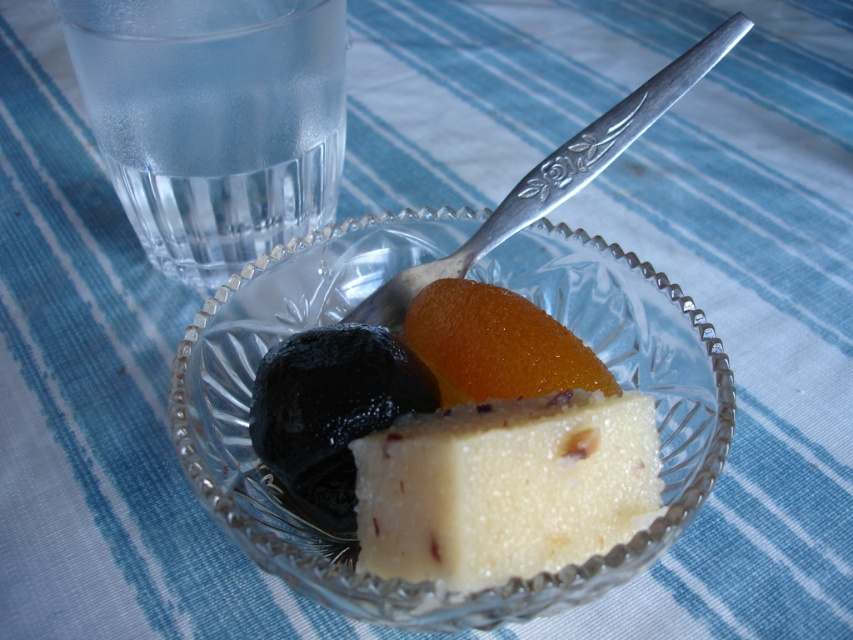
Can you confirm if clear crystal bowl at center is bigger than transparent glass water at upper left?

Yes, clear crystal bowl at center is bigger than transparent glass water at upper left.

Is clear crystal bowl at center to the left of transparent glass water at upper left from the viewer's perspective?

Result: No, clear crystal bowl at center is not to the left of transparent glass water at upper left.

The height and width of the screenshot is (640, 853). What do you see at coordinates (473, 278) in the screenshot? I see `clear crystal bowl at center` at bounding box center [473, 278].

You are a GUI agent. You are given a task and a screenshot of the screen. Output one action in this format:
    pyautogui.click(x=<x>, y=<y>)
    Task: Click on the clear crystal bowl at center
    This screenshot has height=640, width=853.
    Given the screenshot: What is the action you would take?
    pyautogui.click(x=473, y=278)

Is clear crystal bowl at center further to the viewer compared to polished silver spoon at upper center?

No, it is in front of polished silver spoon at upper center.

Who is higher up, clear crystal bowl at center or polished silver spoon at upper center?

polished silver spoon at upper center is above.

What do you see at coordinates (473, 278) in the screenshot? Image resolution: width=853 pixels, height=640 pixels. I see `clear crystal bowl at center` at bounding box center [473, 278].

What are the coordinates of `clear crystal bowl at center` in the screenshot? It's located at (473, 278).

Who is lower down, transparent glass water at upper left or glossy orange fruit at center?

glossy orange fruit at center

Does transparent glass water at upper left have a larger size compared to glossy orange fruit at center?

Yes.

I want to click on transparent glass water at upper left, so click(x=213, y=120).